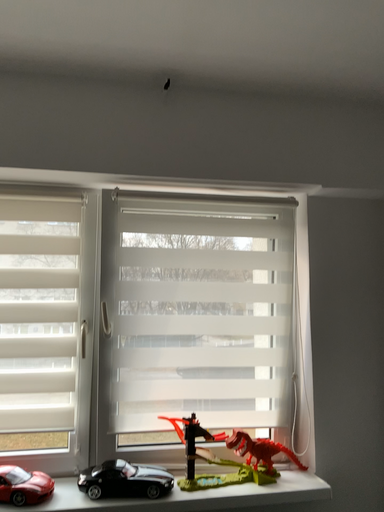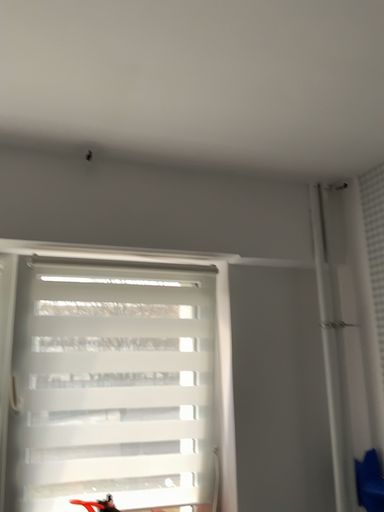
Question: How did the camera likely rotate when shooting the video?

Choices:
 (A) rotated downward
 (B) rotated upward

Answer: (B)